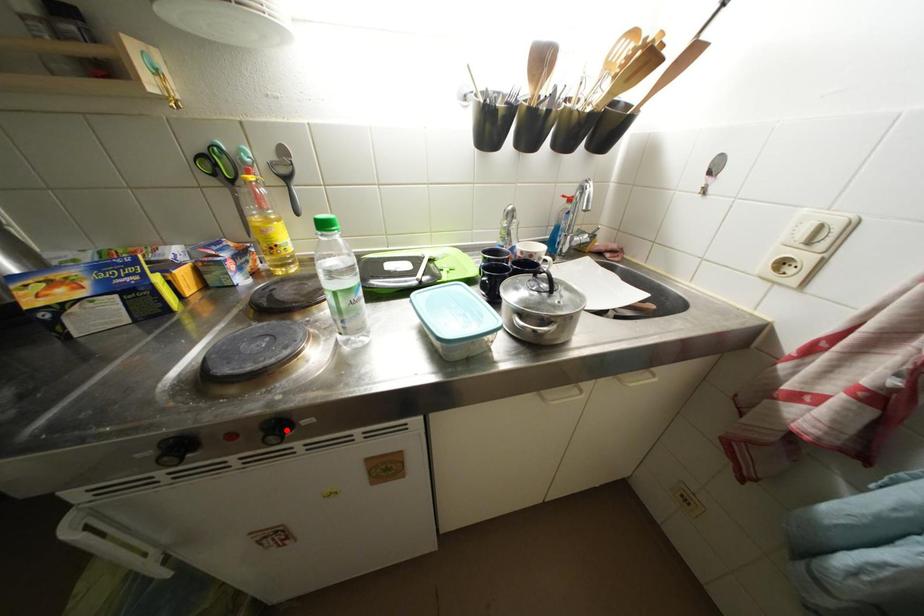
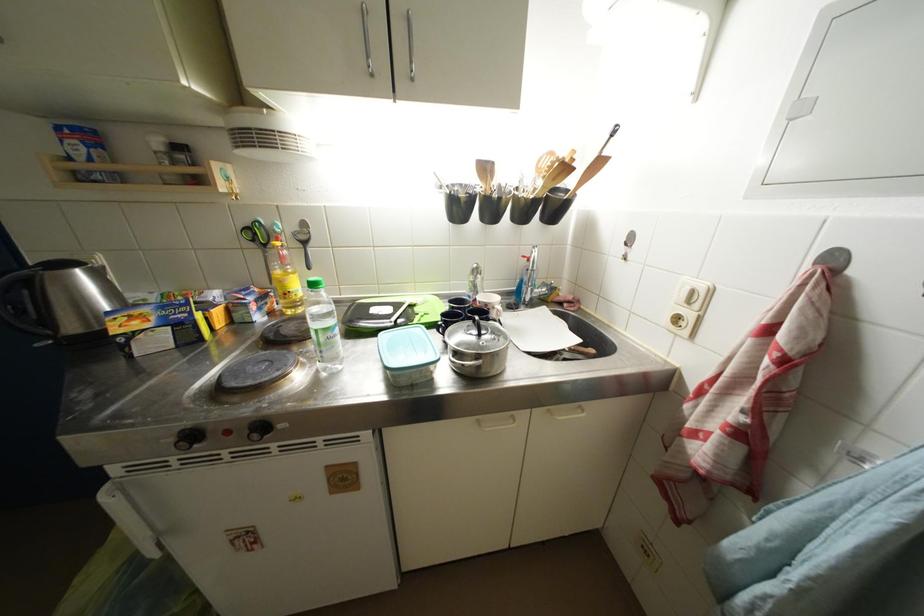
Find the pixel in the second image that matches the highlighted location in the first image.

(269, 431)